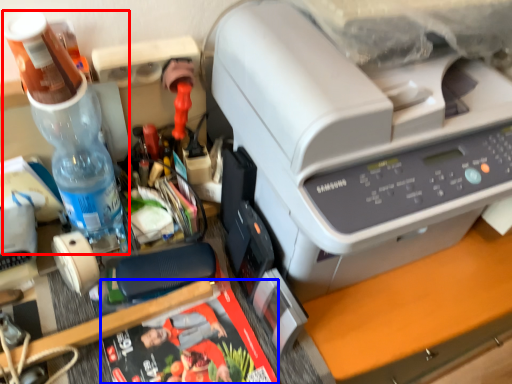
Question: Which object appears farthest to the camera in this image, bottle (highlighted by a red box) or magazine (highlighted by a blue box)?

Choices:
 (A) bottle
 (B) magazine

Answer: (B)